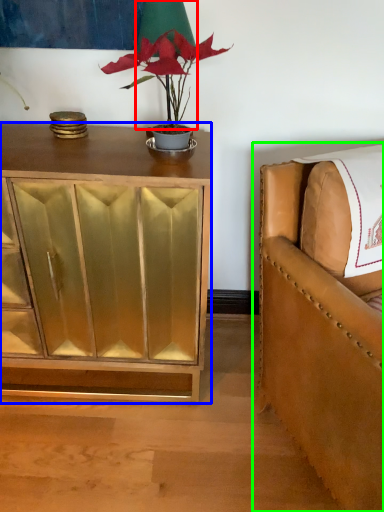
Question: Based on their relative distances, which object is farther from table lamp (highlighted by a red box)? Choose from cabinetry (highlighted by a blue box) and chair (highlighted by a green box).

Choices:
 (A) cabinetry
 (B) chair

Answer: (B)